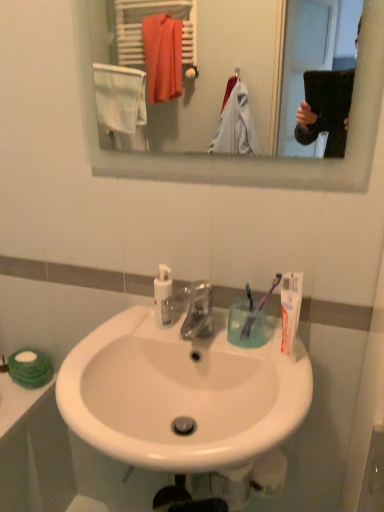
Question: Visually, is clear glass mirror at upper center positioned to the left or to the right of purple plastic toothbrush at right, acting as the 2th toothbrush starting from the left?

Choices:
 (A) left
 (B) right

Answer: (A)

Question: Is point (241, 57) closer or farther from the camera than point (246, 335)?

Choices:
 (A) farther
 (B) closer

Answer: (A)

Question: Estimate the real-world distances between objects in this image. Which object is farther from the white plastic pump bottle at center?

Choices:
 (A) purple plastic toothbrush at right, marked as the first toothbrush in a right-to-left arrangement
 (B) clear plastic faucet at center
 (C) clear glass mirror at upper center
 (D) white glossy sink at center
 (E) white matte tube of toothpaste at right

Answer: (C)

Question: Which of these objects is positioned closest to the white glossy sink at center?

Choices:
 (A) clear glass mirror at upper center
 (B) white matte tube of toothpaste at right
 (C) clear plastic faucet at center
 (D) translucent plastic cup at sink
 (E) white plastic pump bottle at center

Answer: (C)